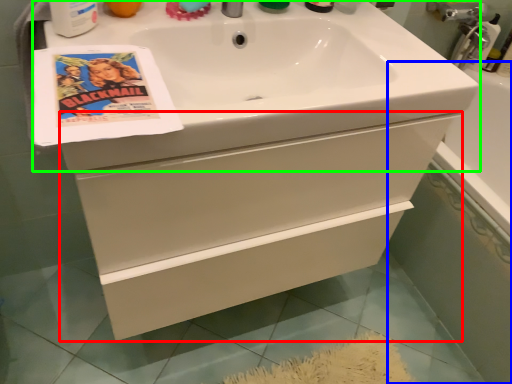
Question: Considering the real-world distances, which object is closest to bathroom cabinet (highlighted by a red box)? bath (highlighted by a blue box) or sink (highlighted by a green box).

Choices:
 (A) bath
 (B) sink

Answer: (B)